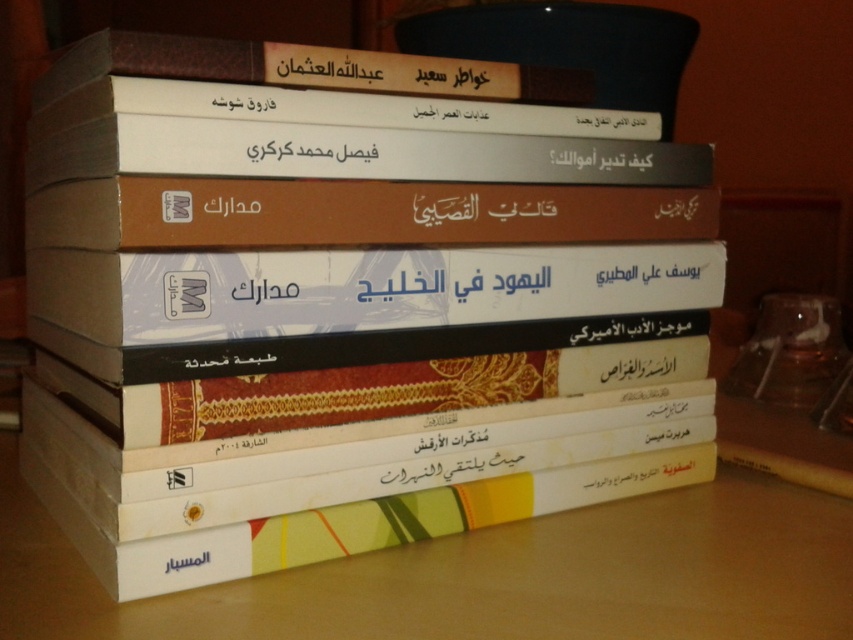
Question: Which object appears farthest from the camera in this image?

Choices:
 (A) black paper text at center
 (B) white paper books at center
 (C) white glossy book at center

Answer: (A)

Question: Which point appears farthest from the camera in this image?

Choices:
 (A) (228, 324)
 (B) (322, 160)
 (C) (625, 518)

Answer: (C)

Question: Can you confirm if white paper books at center is positioned to the right of black paper text at center?

Choices:
 (A) no
 (B) yes

Answer: (B)

Question: Is white paper books at center wider than white glossy book at center?

Choices:
 (A) yes
 (B) no

Answer: (A)

Question: Is white paper books at center positioned in front of white glossy book at center?

Choices:
 (A) no
 (B) yes

Answer: (B)

Question: Which of the following is the farthest from the observer?

Choices:
 (A) (595, 308)
 (B) (773, 636)
 (C) (341, 138)

Answer: (A)